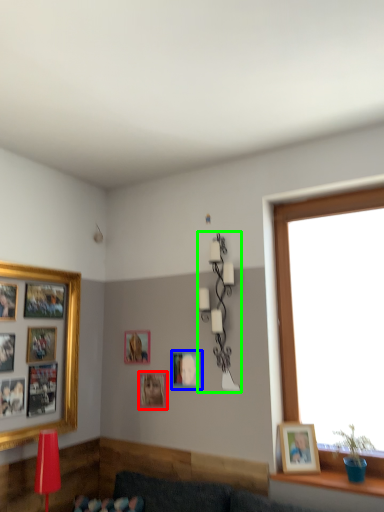
Question: Considering the real-world distances, which object is farthest from picture frame (highlighted by a red box)? picture frame (highlighted by a blue box) or lamp (highlighted by a green box)?

Choices:
 (A) picture frame
 (B) lamp

Answer: (B)